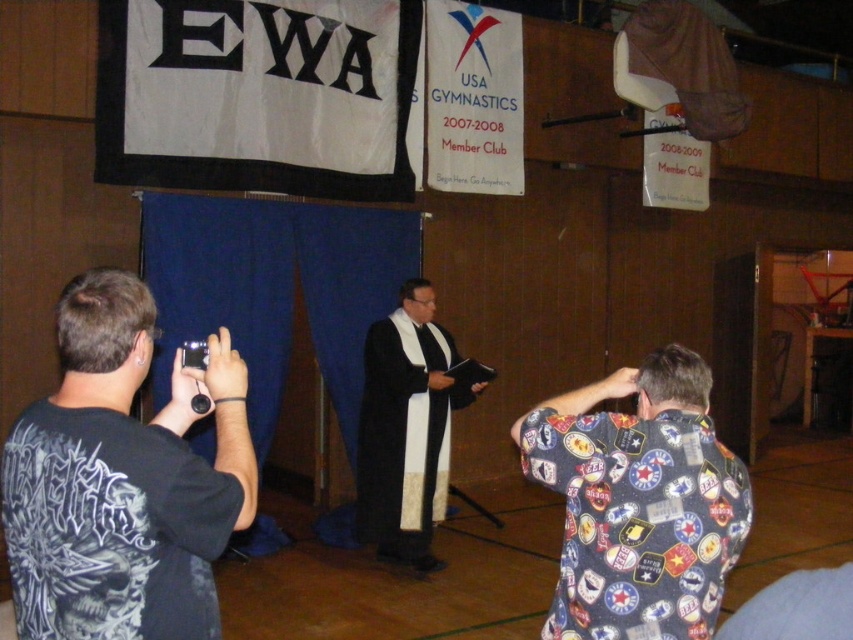
You are standing at the center of the gymnasium and looking towards the banners. Where is the black matte shirt at left located relative to your position?

The black matte shirt at left is located at point 0.750 on the x axis and 0.144 on the y axis relative to the center of the gymnasium.

You are standing in the gymnasium and see the point at coordinates (122, 480). According to the scene description, which object is this point located on?

The point at coordinates (122, 480) is located on the black matte shirt at left.

Consider the image. You are attending a photography event and notice two photographers in the front row. One is wearing a black matte shirt at left and the other a black matte robe at center. From your perspective, which photographer is closer to you?

The black matte shirt at left is closer to you because it is in front of the black matte robe at center.